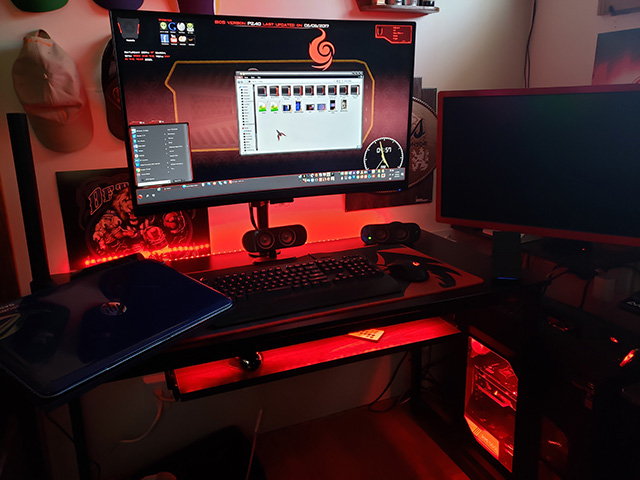
Locate an element on the screen. remote is located at coordinates (369, 332).